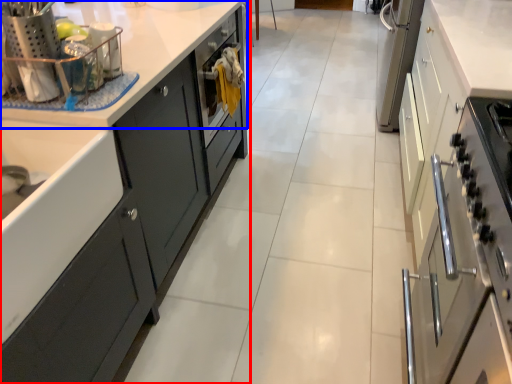
Question: Which of the following is the farthest to the observer, cabinetry (highlighted by a red box) or countertop (highlighted by a blue box)?

Choices:
 (A) cabinetry
 (B) countertop

Answer: (B)